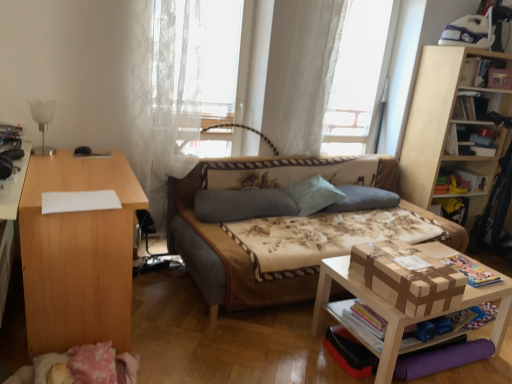
Describe the element at coordinates (479, 70) in the screenshot. I see `hardcover book at upper right, the 2th book in the right-to-left sequence` at that location.

Describe the element at coordinates (362, 199) in the screenshot. This screenshot has height=384, width=512. I see `blue fabric pillow at center, which is counted as the 1th pillow, starting from the right` at that location.

What is the approximate width of light wood desk at left, the 2th table when ordered from right to left?

The width of light wood desk at left, the 2th table when ordered from right to left, is 20.64 inches.

What do you see at coordinates (78, 254) in the screenshot? Image resolution: width=512 pixels, height=384 pixels. I see `light wood desk at left, the 2th table when ordered from right to left` at bounding box center [78, 254].

You are a GUI agent. You are given a task and a screenshot of the screen. Output one action in this format:
    pyautogui.click(x=<x>, y=<y>)
    Task: Click on the hardcover book at left, positioned as the 2th book in front-to-back order
    This screenshot has width=512, height=384.
    Given the screenshot: What is the action you would take?
    pyautogui.click(x=10, y=136)

Identify the location of hardcover book at upper right, marked as the 4th book in a bottom-to-top arrangement. (479, 70).

Find the location of `book located on the left of light wood desk at left, positioned as the first table in left-to-right order`. book located on the left of light wood desk at left, positioned as the first table in left-to-right order is located at coordinates (10, 136).

Based on their sizes in the image, would you say hardcover book at left, marked as the 1th book in a left-to-right arrangement, is bigger or smaller than light wood desk at left, the 2th table when ordered from right to left?

Clearly, hardcover book at left, marked as the 1th book in a left-to-right arrangement, is smaller in size than light wood desk at left, the 2th table when ordered from right to left.

Who is shorter, hardcover book at left, positioned as the 2th book in front-to-back order, or light wood desk at left, the 2th table when ordered from right to left?

With less height is hardcover book at left, positioned as the 2th book in front-to-back order.

Can you see hardcover book at left, marked as the 1th book in a left-to-right arrangement, touching light wood desk at left, the 2th table when ordered from right to left?

No, hardcover book at left, marked as the 1th book in a left-to-right arrangement, is not next to light wood desk at left, the 2th table when ordered from right to left.

Can you confirm if floral fabric studio couch at center is smaller than wooden toy box at right?

No, floral fabric studio couch at center is not smaller than wooden toy box at right.

From the image's perspective, is floral fabric studio couch at center under wooden toy box at right?

Correct, floral fabric studio couch at center appears lower than wooden toy box at right in the image.

What's the angular difference between floral fabric studio couch at center and wooden toy box at right's facing directions?

They differ by 5.47 degrees in their facing directions.

Does floral fabric studio couch at center have a greater height compared to wooden toy box at right?

Yes, floral fabric studio couch at center is taller than wooden toy box at right.

Is white lace curtain at upper center oriented away from white lace curtain at upper center, the 2th curtain positioned from the left?

No, white lace curtain at upper center is not facing the opposite direction of white lace curtain at upper center, the 2th curtain positioned from the left.

Identify the location of the 1st curtain positioned below the white lace curtain at upper center (from a real-world perspective). (301, 72).

Considering the positions of points (352, 0) and (271, 99), is point (352, 0) closer to camera compared to point (271, 99)?

Yes, point (352, 0) is closer to viewer.

From a real-world perspective, which is physically above, floral fabric studio couch at center or light blue fabric pillow at center, which is the 2th pillow in right-to-left order?

In real-world perspective, light blue fabric pillow at center, which is the 2th pillow in right-to-left order, is above.

Locate an element on the screen. studio couch located below the light blue fabric pillow at center, which ranks as the 2th pillow in left-to-right order (from the image's perspective) is located at coordinates (236, 243).

From the image's perspective, which one is positioned lower, floral fabric studio couch at center or light blue fabric pillow at center, which is the 2th pillow in right-to-left order?

From the image's view, floral fabric studio couch at center is below.

In the scene shown: Considering the sizes of objects white lace curtain at upper center and white glass lamp at left in the image provided, who is wider, white lace curtain at upper center or white glass lamp at left?

white lace curtain at upper center is wider.

From the image's perspective, which is above, white lace curtain at upper center or white glass lamp at left?

white lace curtain at upper center appears higher in the image.

Could you tell me if white lace curtain at upper center is turned towards white glass lamp at left?

No, white lace curtain at upper center is not aimed at white glass lamp at left.

Can you confirm if gray fabric pillow at center, which is counted as the 1th pillow, starting from the left, is wider than hardcover book at left, the fourth book viewed from the right?

Yes.

Is gray fabric pillow at center, which is counted as the 1th pillow, starting from the left, positioned with its back to hardcover book at left, arranged as the 3th book when viewed from the top?

No, gray fabric pillow at center, which is counted as the 1th pillow, starting from the left, is not facing away from hardcover book at left, arranged as the 3th book when viewed from the top.

Consider the image. Are gray fabric pillow at center, positioned as the third pillow in right-to-left order, and hardcover book at left, positioned as the 2th book in front-to-back order, making contact?

No, gray fabric pillow at center, positioned as the third pillow in right-to-left order, is not beside hardcover book at left, positioned as the 2th book in front-to-back order.

Based on their sizes in the image, would you say light wood desk at left, the 2th table when ordered from right to left, is bigger or smaller than white lace curtain at upper center?

In the image, light wood desk at left, the 2th table when ordered from right to left, appears to be larger than white lace curtain at upper center.

Is light wood desk at left, the 2th table when ordered from right to left, at the left side of white lace curtain at upper center?

Correct, you'll find light wood desk at left, the 2th table when ordered from right to left, to the left of white lace curtain at upper center.

Is light wood desk at left, the 2th table when ordered from right to left, in contact with white lace curtain at upper center?

No, light wood desk at left, the 2th table when ordered from right to left, is not in contact with white lace curtain at upper center.

From a real-world perspective, which is physically above, light wood desk at left, the 2th table when ordered from right to left, or white lace curtain at upper center?

In real-world perspective, white lace curtain at upper center is above.

You are a GUI agent. You are given a task and a screenshot of the screen. Output one action in this format:
    pyautogui.click(x=<x>, y=<y>)
    Task: Click on the 1st table to the right when counting from the hardcover book at left, arranged as the 3th book when viewed from the top
    The image size is (512, 384).
    Given the screenshot: What is the action you would take?
    coord(78,254)

Find the location of a particular element. The width and height of the screenshot is (512, 384). shelf that appears behind the floral fabric studio couch at center is located at coordinates pos(465,180).

Estimate the real-world distances between objects in this image. Which object is closer to white lace curtain at upper center, acting as the second curtain starting from the right, brown cardboard book at lower right, the 3th book viewed from the right, or hardcover book at upper right, the fourth book in the left-to-right sequence?

brown cardboard book at lower right, the 3th book viewed from the right, is positioned closer to the anchor white lace curtain at upper center, acting as the second curtain starting from the right.

Considering their positions, is white wood table at lower right, which is the first table in right-to-left order, positioned further to blue fabric pillow at center, which is counted as the 1th pillow, starting from the right, than hardcover book at left, arranged as the 3th book when viewed from the top?

hardcover book at left, arranged as the 3th book when viewed from the top.

When comparing their distances from white lace curtain at upper center, acting as the second curtain starting from the right, does hardcover book at upper right, the fourth book in the left-to-right sequence, or wooden toy box at right seem further?

The object further to white lace curtain at upper center, acting as the second curtain starting from the right, is wooden toy box at right.

In the scene shown: Looking at the image, which one is located further to white lace curtain at upper center, which ranks as the first curtain in right-to-left order, brown cardboard book at lower right, marked as the fourth book in a top-to-bottom arrangement, or white lace curtain at upper center?

brown cardboard book at lower right, marked as the fourth book in a top-to-bottom arrangement, is positioned further to the anchor white lace curtain at upper center, which ranks as the first curtain in right-to-left order.

Considering their positions, is blue fabric pillow at center, placed as the 3th pillow when sorted from left to right, positioned closer to hardcover book at upper right, the third book when ordered from front to back, than white wood table at lower right, which is the first table in right-to-left order?

blue fabric pillow at center, placed as the 3th pillow when sorted from left to right, lies closer to hardcover book at upper right, the third book when ordered from front to back, than the other object.

When comparing their distances from white wood table at lower right, which is the first table in right-to-left order, does white glass lamp at left or wooden toy box at right seem closer?

wooden toy box at right lies closer to white wood table at lower right, which is the first table in right-to-left order, than the other object.

Which object lies nearer to the anchor point white wood table at lower right, positioned as the second table in left-to-right order, wooden bookcase at upper right or floral fabric studio couch at center?

floral fabric studio couch at center is positioned closer to the anchor white wood table at lower right, positioned as the second table in left-to-right order.

From the image, which object appears to be nearer to light wood desk at left, positioned as the first table in left-to-right order, hardcover book at left, positioned as the 2th book in front-to-back order, or hardcover book at upper right, marked as the 4th book in a bottom-to-top arrangement?

hardcover book at left, positioned as the 2th book in front-to-back order, lies closer to light wood desk at left, positioned as the first table in left-to-right order, than the other object.

Where is `table situated between white lace curtain at upper center, the 1th curtain in the left-to-right sequence, and wooden bookcase at upper right from left to right`? This screenshot has width=512, height=384. table situated between white lace curtain at upper center, the 1th curtain in the left-to-right sequence, and wooden bookcase at upper right from left to right is located at coordinates (403, 313).

Identify the location of studio couch situated between hardcover book at left, the fourth book viewed from the right, and wooden bookcase at upper right from left to right. (236, 243).

Image resolution: width=512 pixels, height=384 pixels. Find the location of `window screen between white lace curtain at upper center, the 1th curtain in the left-to-right sequence, and wooden toy box at right, in the horizontal direction`. window screen between white lace curtain at upper center, the 1th curtain in the left-to-right sequence, and wooden toy box at right, in the horizontal direction is located at coordinates (358, 78).

The height and width of the screenshot is (384, 512). Find the location of `studio couch between white lace curtain at upper center, the 1th curtain in the left-to-right sequence, and brown cardboard book at lower right, the 3th book viewed from the right`. studio couch between white lace curtain at upper center, the 1th curtain in the left-to-right sequence, and brown cardboard book at lower right, the 3th book viewed from the right is located at coordinates (236, 243).